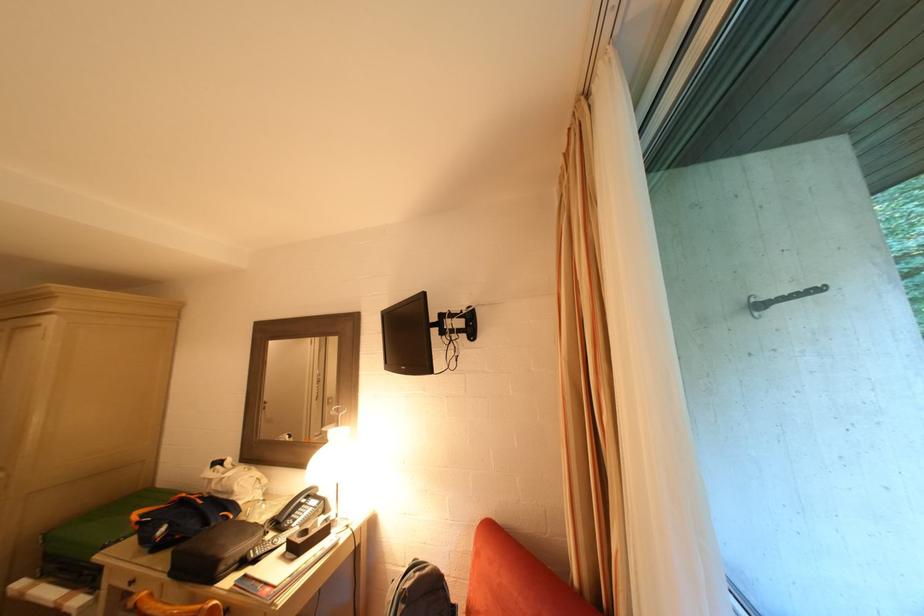
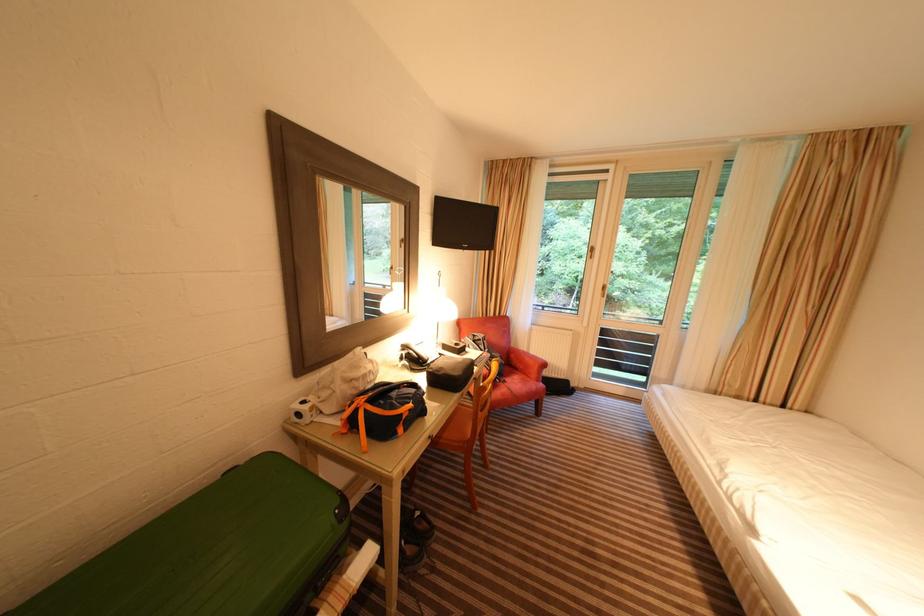
The point at [306,508] is marked in the first image. Where is the corresponding point in the second image?

(423, 355)